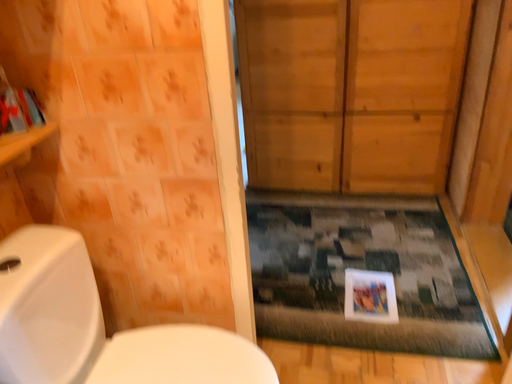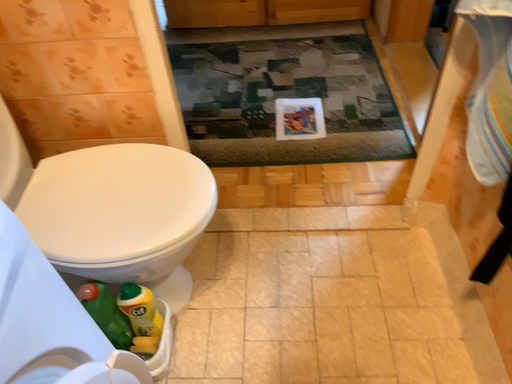
Question: How did the camera likely rotate when shooting the video?

Choices:
 (A) rotated downward
 (B) rotated upward

Answer: (A)